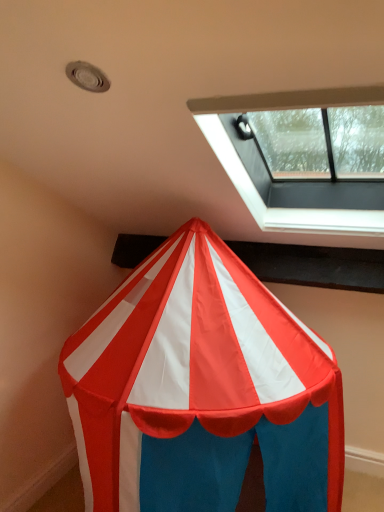
Identify the location of transparent glass window at upper right. Image resolution: width=384 pixels, height=512 pixels. (250, 178).

Describe the element at coordinates (250, 178) in the screenshot. I see `transparent glass window at upper right` at that location.

Identify the location of transparent glass window at upper right. (250, 178).